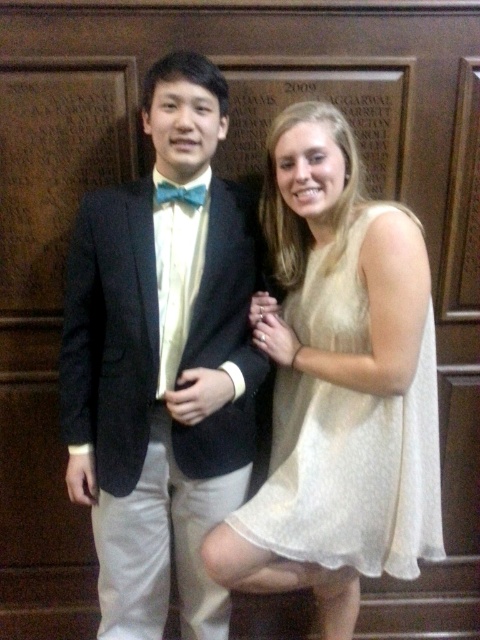
Question: Which point appears farthest from the camera in this image?

Choices:
 (A) (187, 188)
 (B) (84, 451)
 (C) (342, 518)

Answer: (B)

Question: Can you confirm if matte black suit at center is smaller than blue satin bow tie at center?

Choices:
 (A) yes
 (B) no

Answer: (B)

Question: Which object is farther from the camera taking this photo?

Choices:
 (A) matte black suit at center
 (B) white textured dress at center

Answer: (B)

Question: Which of the following is the closest to the observer?

Choices:
 (A) (192, 202)
 (B) (388, 404)
 (C) (192, 332)

Answer: (C)

Question: Does matte black suit at center appear on the left side of blue satin bow tie at center?

Choices:
 (A) yes
 (B) no

Answer: (A)

Question: Does matte black suit at center have a lesser width compared to white textured dress at center?

Choices:
 (A) no
 (B) yes

Answer: (B)